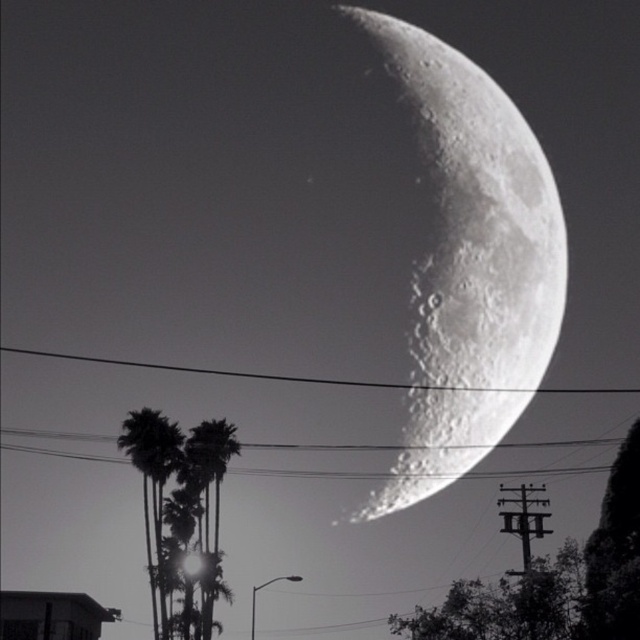
Does green leafy palm tree at center appear on the right side of metallic wire at upper center?

Incorrect, green leafy palm tree at center is not on the right side of metallic wire at upper center.

Between green leafy palm tree at center and metallic wire at upper center, which one is positioned lower?

green leafy palm tree at center is below.

Is point (205, 588) in front of point (221, 371)?

Yes.

Locate an element on the screen. green leafy palm tree at center is located at coordinates (208, 497).

Does silhouette palm trees at lower left appear under metallic wire at upper center?

Indeed, silhouette palm trees at lower left is positioned under metallic wire at upper center.

Does silhouette palm trees at lower left have a larger size compared to metallic wire at upper center?

Incorrect, silhouette palm trees at lower left is not larger than metallic wire at upper center.

What are the coordinates of `silhouette palm trees at lower left` in the screenshot? It's located at (152, 483).

Identify the location of silhouette palm trees at lower left. The image size is (640, 640). (152, 483).

Measure the distance from silhouette palm trees at lower left to green leafy palm tree at center.

2.60 meters

Does point (160, 525) come closer to viewer compared to point (209, 564)?

No, it is not.

Locate an element on the screen. Image resolution: width=640 pixels, height=640 pixels. silhouette palm trees at lower left is located at coordinates (152, 483).